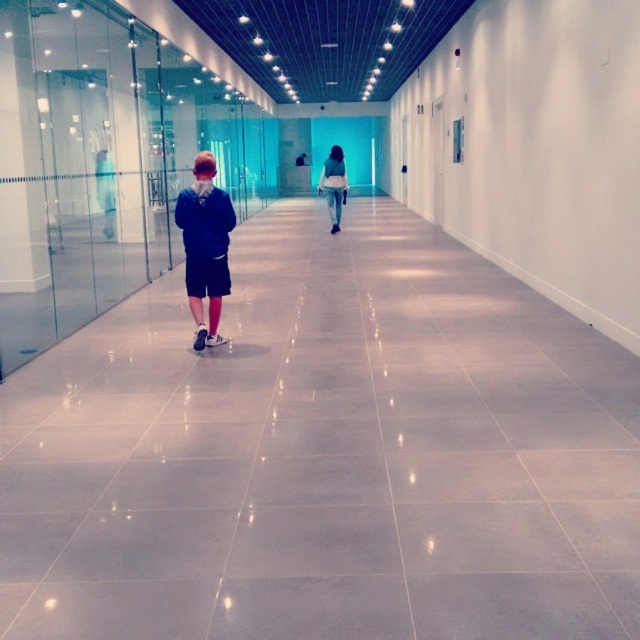
From the picture: You are standing at the entrance of the corridor and notice the gray tile floor at center. Based on its position, can you determine if it is closer to the entrance or the far end of the corridor?

The gray tile floor at center is located at point coordinates that suggest it is closer to the entrance than the far end of the corridor.

You are a delivery person carrying a matte blue hoodie at center and standing on the gray tile floor at center. You want to place the hoodie on the floor. Is the floor under the hoodie already?

The gray tile floor at center is positioned under the matte blue hoodie at center, so yes, the floor is already under the hoodie, meaning you can place it there.